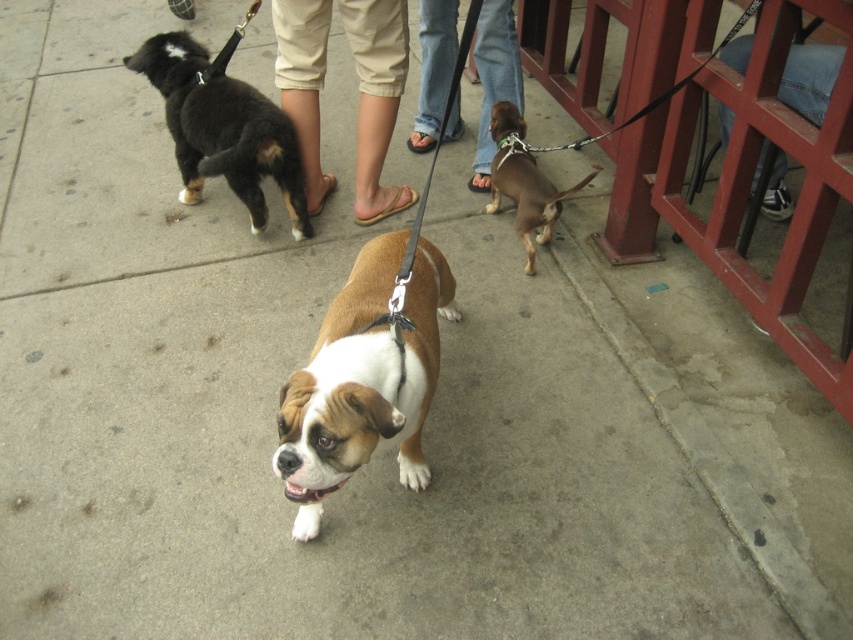
You are a dog owner trying to decide which dog to approach first. The black fur dog at left is pulling its leash towards the red metal railing, while the tan fabric pants at center is being pulled by its owner towards the sidewalk. Based on their sizes, which dog should you approach first?

The black fur dog at left is bigger than the tan fabric pants at center, so you should approach the black fur dog at left first because it may require more attention due to its larger size.

You are a dog owner walking your dog on the sidewalk. You notice the black fur dog at left and the tan fabric pants at center in the scene. Which of these two items is taller?

The black fur dog at left is much taller than the tan fabric pants at center.